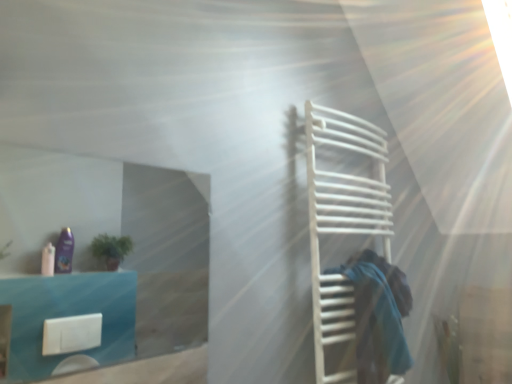
Question: Is white matte towel rack at right at the back of blue fabric at right?

Choices:
 (A) no
 (B) yes

Answer: (B)

Question: Does blue fabric at right come behind white matte towel rack at right?

Choices:
 (A) no
 (B) yes

Answer: (B)

Question: Is blue fabric at right touching white matte towel rack at right?

Choices:
 (A) no
 (B) yes

Answer: (A)

Question: Is blue fabric at right closer to the viewer compared to white matte towel rack at right?

Choices:
 (A) no
 (B) yes

Answer: (A)

Question: Is blue fabric at right not inside white matte towel rack at right?

Choices:
 (A) no
 (B) yes

Answer: (A)

Question: Does point (358, 200) appear closer or farther from the camera than point (379, 322)?

Choices:
 (A) farther
 (B) closer

Answer: (A)

Question: Considering the positions of white matte towel rack at right and blue fabric at right in the image, is white matte towel rack at right wider or thinner than blue fabric at right?

Choices:
 (A) thin
 (B) wide

Answer: (B)

Question: Considering the relative positions of white matte towel rack at right and blue fabric at right in the image provided, is white matte towel rack at right to the left or to the right of blue fabric at right?

Choices:
 (A) right
 (B) left

Answer: (A)

Question: Is white matte towel rack at right inside the boundaries of blue fabric at right, or outside?

Choices:
 (A) outside
 (B) inside

Answer: (A)

Question: Would you say blue fabric at right is inside or outside transparent glass door at upper left?

Choices:
 (A) outside
 (B) inside

Answer: (A)

Question: Based on their positions, is blue fabric at right located to the left or right of transparent glass door at upper left?

Choices:
 (A) left
 (B) right

Answer: (B)

Question: Relative to transparent glass door at upper left, is blue fabric at right in front or behind?

Choices:
 (A) front
 (B) behind

Answer: (B)

Question: Looking at the image, does blue fabric at right seem bigger or smaller compared to transparent glass door at upper left?

Choices:
 (A) big
 (B) small

Answer: (A)

Question: Is white matte towel rack at right taller or shorter than transparent glass door at upper left?

Choices:
 (A) tall
 (B) short

Answer: (A)

Question: Relative to transparent glass door at upper left, is white matte towel rack at right in front or behind?

Choices:
 (A) front
 (B) behind

Answer: (B)